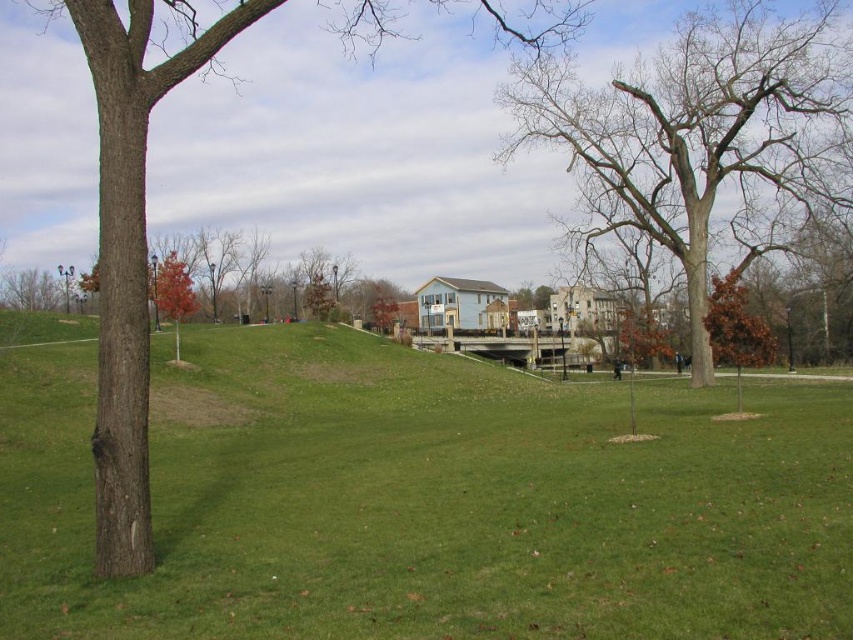
Question: Which point is farther to the camera?

Choices:
 (A) (747, 148)
 (B) (172, 67)

Answer: (A)

Question: Which of the following is the closest to the observer?

Choices:
 (A) (705, 477)
 (B) (264, 3)

Answer: (B)

Question: Can you confirm if green grassy at center is thinner than bare wood tree at center?

Choices:
 (A) yes
 (B) no

Answer: (B)

Question: Is bare wood tree at center positioned in front of brown rough bark tree at left?

Choices:
 (A) yes
 (B) no

Answer: (B)

Question: Is green grassy at center behind brown rough bark tree at left?

Choices:
 (A) yes
 (B) no

Answer: (B)

Question: Which object is the farthest from the bare wood tree at center?

Choices:
 (A) green grassy at center
 (B) brown rough bark tree at left

Answer: (B)